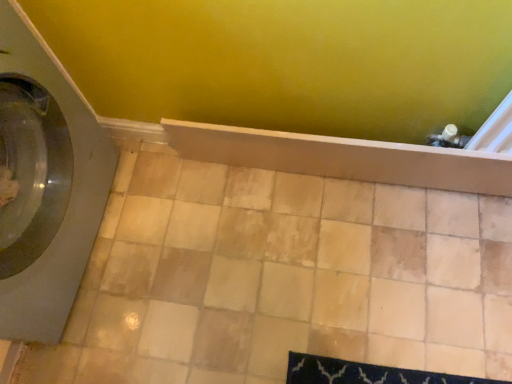
Question: Visually, is beige ceramic tile at center positioned to the left or to the right of wooden shelf at center?

Choices:
 (A) right
 (B) left

Answer: (B)

Question: Looking at the image, does beige ceramic tile at center seem bigger or smaller compared to wooden shelf at center?

Choices:
 (A) small
 (B) big

Answer: (B)

Question: Which object is positioned closest to the satin gray washing machine at left?

Choices:
 (A) beige ceramic tile at center
 (B) wooden shelf at center

Answer: (A)

Question: Which is nearer to the satin gray washing machine at left?

Choices:
 (A) wooden shelf at center
 (B) beige ceramic tile at center

Answer: (B)